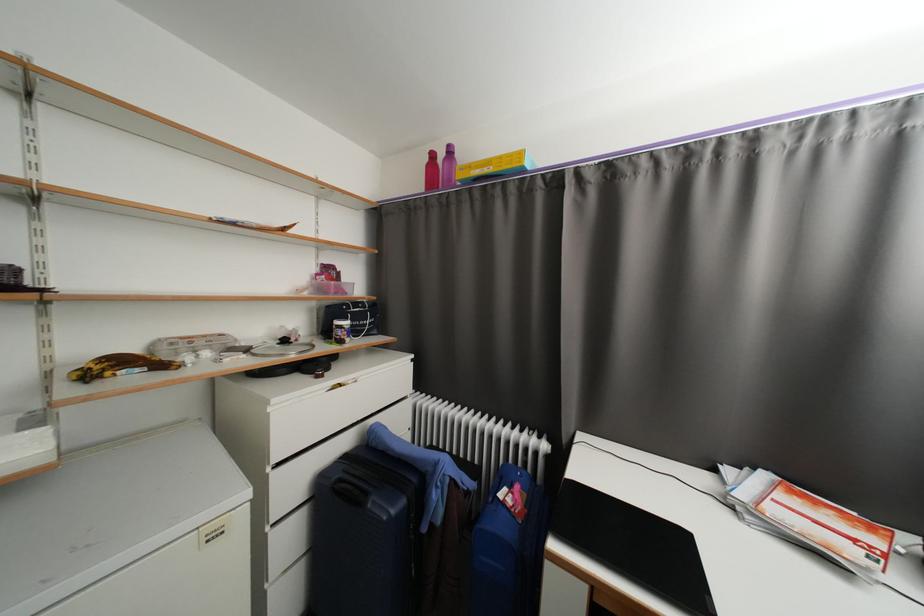
The height and width of the screenshot is (616, 924). What do you see at coordinates (341, 331) in the screenshot?
I see `the small food jar` at bounding box center [341, 331].